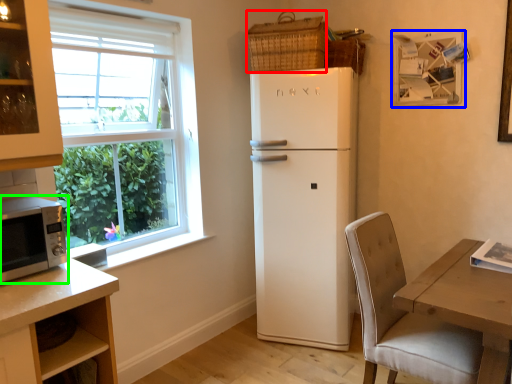
Question: Which object is positioned farthest from basket (highlighted by a red box)? Select from picture frame (highlighted by a blue box) and microwave oven (highlighted by a green box).

Choices:
 (A) picture frame
 (B) microwave oven

Answer: (B)